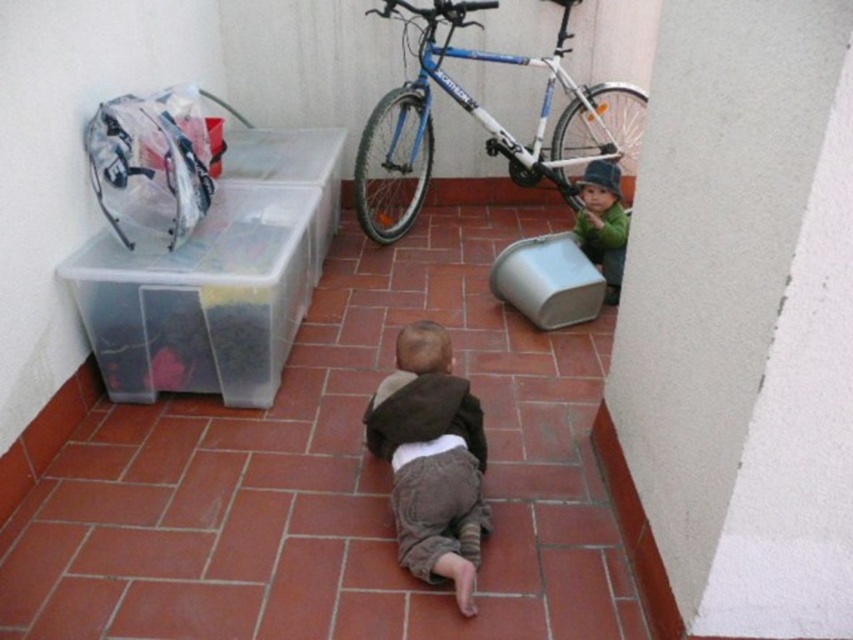
Question: Observing the image, what is the correct spatial positioning of brown soft fabric at center in reference to green fuzzy hat at lower right?

Choices:
 (A) above
 (B) below

Answer: (B)

Question: Does brown soft fabric at center appear over green fuzzy hat at lower right?

Choices:
 (A) yes
 (B) no

Answer: (B)

Question: Which point is closer to the camera?

Choices:
 (A) pos(618,216)
 (B) pos(606,102)
 (C) pos(463,566)

Answer: (C)

Question: Estimate the real-world distances between objects in this image. Which object is closer to the green fuzzy hat at lower right?

Choices:
 (A) blue metallic bicycle at upper center
 (B) brown soft fabric at center

Answer: (A)

Question: Is brown soft fabric at center smaller than green fuzzy hat at lower right?

Choices:
 (A) yes
 (B) no

Answer: (B)

Question: Which point appears farthest from the camera in this image?

Choices:
 (A) (418, 493)
 (B) (581, 184)
 (C) (430, 134)

Answer: (C)